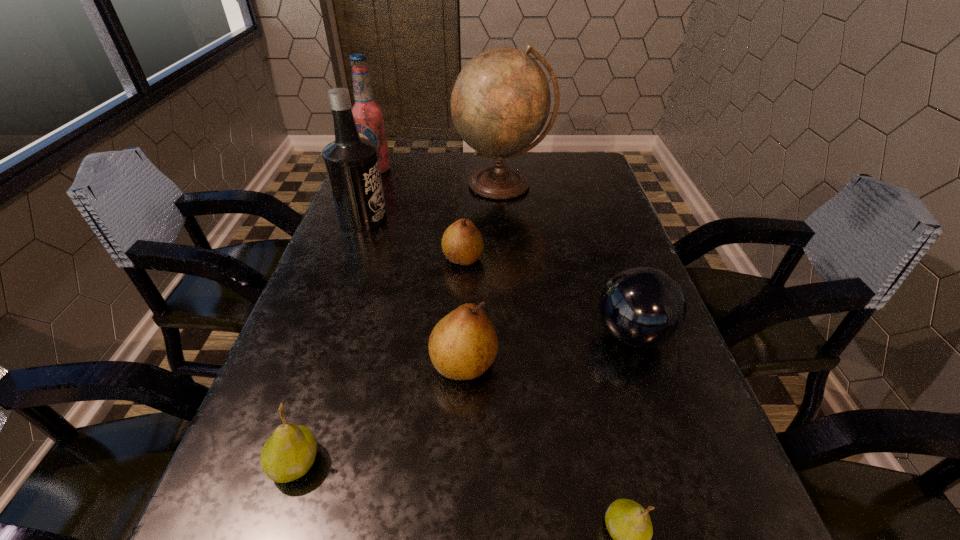
Image resolution: width=960 pixels, height=540 pixels. Identify the location of alcohol positioned at the far edge. (369, 117).

This screenshot has width=960, height=540. Identify the location of liquor that is at the left edge. (352, 165).

The image size is (960, 540). In order to click on alcohol that is at the left edge in this screenshot , I will do `click(369, 117)`.

Where is `pear that is at the left edge`? This screenshot has width=960, height=540. pear that is at the left edge is located at coordinates (289, 453).

You are a GUI agent. You are given a task and a screenshot of the screen. Output one action in this format:
    pyautogui.click(x=<x>, y=<y>)
    Task: Click on the object that is positioned at the right edge
    The width and height of the screenshot is (960, 540).
    Given the screenshot: What is the action you would take?
    pyautogui.click(x=642, y=307)

What are the coordinates of `object located in the far left corner section of the desktop` in the screenshot? It's located at (369, 117).

Image resolution: width=960 pixels, height=540 pixels. I want to click on free space at the far edge of the desktop, so click(x=453, y=179).

This screenshot has width=960, height=540. What are the coordinates of `vacant space at the left edge` in the screenshot? It's located at (276, 492).

Identify the location of vacant space at the right edge. This screenshot has width=960, height=540. pyautogui.click(x=587, y=262).

The height and width of the screenshot is (540, 960). I want to click on free region at the far left corner of the desktop, so click(x=395, y=152).